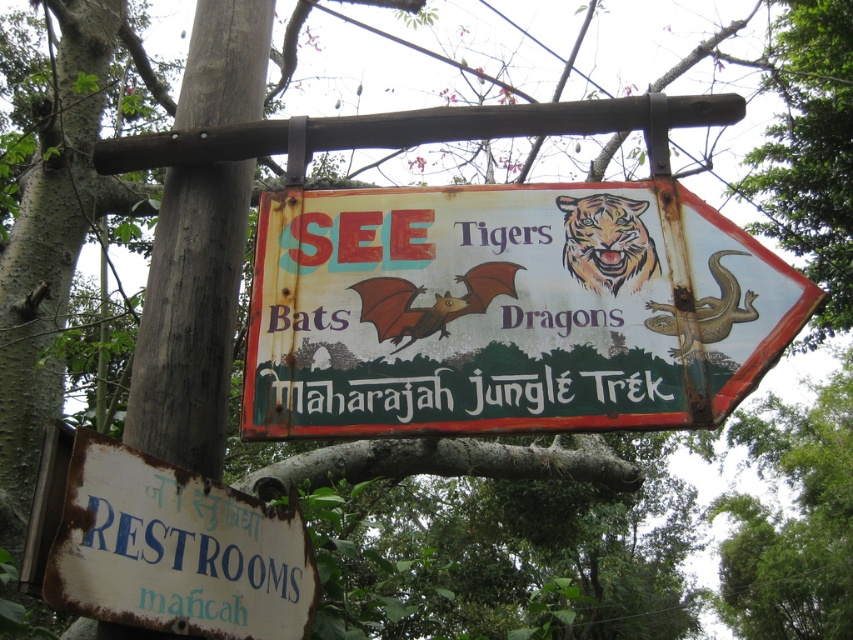
You are a hiker who has come across the rusty white signboard at lower left and the white painted text at center. According to the sign, which direction should you go to see the Tigers?

The rusty white signboard at lower left points to the right, so you should go in that direction to see the Tigers.

You are a hiker who wants to read the white painted text at center on the rusty metal sign at center. Can you easily read the text from a distance of 10 meters away?

The rusty metal sign at center has a greater height compared to white painted text at center. Since the text is smaller relative to the sign, it might be difficult to read from 10 meters away unless you have good eyesight.

You are a photographer trying to capture the entire signboard in your shot. You notice two points on the signboard at coordinates point (628, 317) and point (86, 509). Which point is closer to your camera lens?

Point (628, 317) is further to the camera than point (86, 509), so the point closer to the camera lens is point (86, 509).